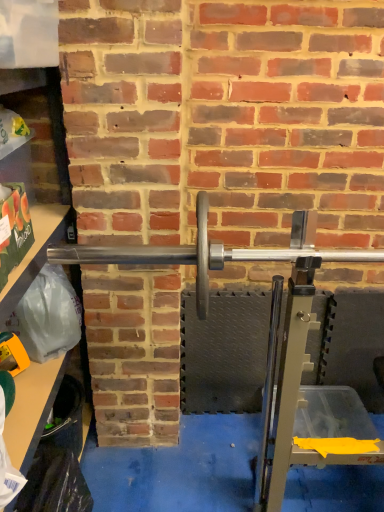
Question: Is clear plastic bag at left oriented away from silver metallic barbell at center?

Choices:
 (A) yes
 (B) no

Answer: (A)

Question: Does clear plastic bag at left contain silver metallic barbell at center?

Choices:
 (A) no
 (B) yes

Answer: (A)

Question: Is clear plastic bag at left placed right next to silver metallic barbell at center?

Choices:
 (A) yes
 (B) no

Answer: (B)

Question: Does clear plastic bag at left lie behind silver metallic barbell at center?

Choices:
 (A) yes
 (B) no

Answer: (B)

Question: From the image's perspective, would you say clear plastic bag at left is shown under silver metallic barbell at center?

Choices:
 (A) yes
 (B) no

Answer: (A)

Question: Is clear plastic bag at left bigger than silver metallic barbell at center?

Choices:
 (A) yes
 (B) no

Answer: (A)

Question: Would you say silver metallic barbell at center is a long distance from clear plastic bag at left?

Choices:
 (A) yes
 (B) no

Answer: (B)

Question: Does silver metallic barbell at center come behind clear plastic bag at left?

Choices:
 (A) no
 (B) yes

Answer: (B)

Question: Is clear plastic bag at left located within silver metallic barbell at center?

Choices:
 (A) no
 (B) yes

Answer: (A)

Question: Does silver metallic barbell at center have a lesser height compared to clear plastic bag at left?

Choices:
 (A) yes
 (B) no

Answer: (A)

Question: Is silver metallic barbell at center smaller than clear plastic bag at left?

Choices:
 (A) yes
 (B) no

Answer: (A)

Question: From the image's perspective, is silver metallic barbell at center under clear plastic bag at left?

Choices:
 (A) no
 (B) yes

Answer: (A)

Question: Is silver metallic barbell at center in front of or behind clear plastic bag at left in the image?

Choices:
 (A) front
 (B) behind

Answer: (B)